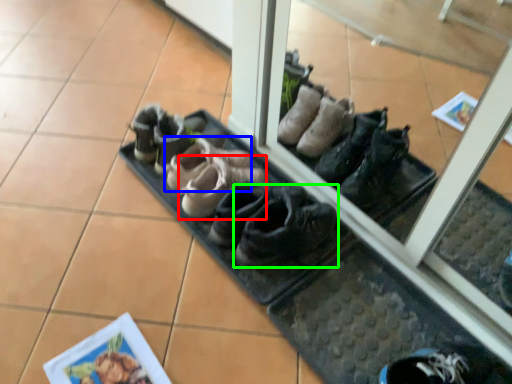
Question: Which is nearer to the footwear (highlighted by a red box)? footwear (highlighted by a blue box) or footwear (highlighted by a green box).

Choices:
 (A) footwear
 (B) footwear

Answer: (A)